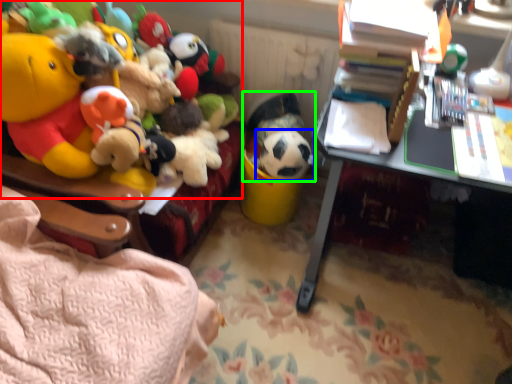
Question: Considering the real-world distances, which object is farthest from toy (highlighted by a red box)? toy (highlighted by a blue box) or toy (highlighted by a green box)?

Choices:
 (A) toy
 (B) toy

Answer: (A)